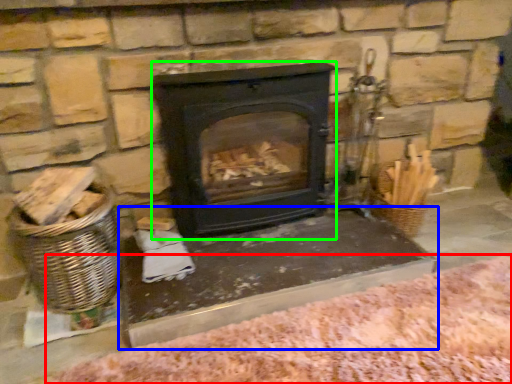
Question: Which object is positioned closest to blanket (highlighted by a red box)? Select from table (highlighted by a blue box) and wood burning stove (highlighted by a green box).

Choices:
 (A) table
 (B) wood burning stove

Answer: (A)